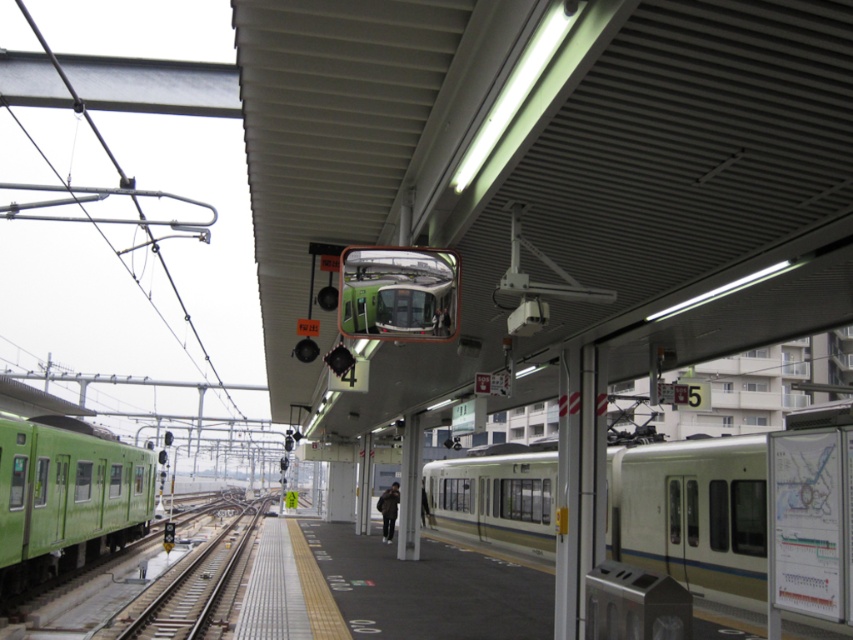
Question: Is silver metallic train at right wider than green matte train at left?

Choices:
 (A) yes
 (B) no

Answer: (A)

Question: Which is nearer to the green metallic train track at center?

Choices:
 (A) green matte train at left
 (B) silver metallic train at right

Answer: (A)

Question: Does silver metallic train at right lie behind green matte train at left?

Choices:
 (A) no
 (B) yes

Answer: (A)

Question: Among these points, which one is farthest from the camera?

Choices:
 (A) (173, 586)
 (B) (82, 452)

Answer: (B)

Question: Among these objects, which one is farthest from the camera?

Choices:
 (A) green metallic train track at center
 (B) green matte train at left

Answer: (B)

Question: Can you confirm if green matte train at left is positioned to the left of green metallic train track at center?

Choices:
 (A) no
 (B) yes

Answer: (B)